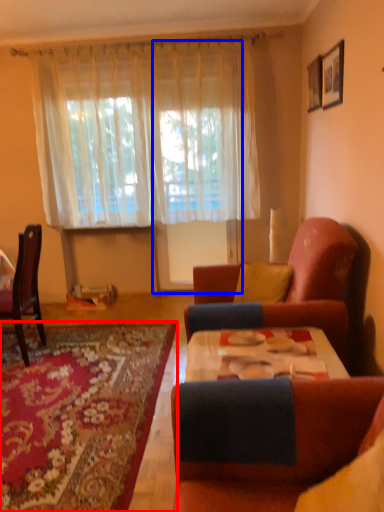
Question: Which point is further to the camera, mat (highlighted by a red box) or glass door (highlighted by a blue box)?

Choices:
 (A) mat
 (B) glass door

Answer: (B)